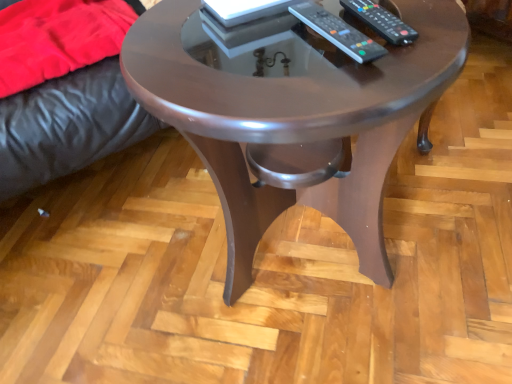
Question: Is shiny brown wood coffee table at center smaller than black plastic remote at center, the first remote in the left-to-right sequence?

Choices:
 (A) no
 (B) yes

Answer: (A)

Question: Is shiny brown wood coffee table at center oriented towards black plastic remote at center, the first remote in the left-to-right sequence?

Choices:
 (A) yes
 (B) no

Answer: (B)

Question: From the image's perspective, is shiny brown wood coffee table at center below black plastic remote at center, the first remote in the left-to-right sequence?

Choices:
 (A) yes
 (B) no

Answer: (A)

Question: Is shiny brown wood coffee table at center positioned with its back to black plastic remote at center, which is the 2th remote from right to left?

Choices:
 (A) yes
 (B) no

Answer: (B)

Question: From a real-world perspective, is shiny brown wood coffee table at center under black plastic remote at center, the first remote in the left-to-right sequence?

Choices:
 (A) yes
 (B) no

Answer: (A)

Question: From the image's perspective, is black plastic remote at center, the first remote in the left-to-right sequence, located above or below black plastic remote at upper right, marked as the 1th remote in a right-to-left arrangement?

Choices:
 (A) above
 (B) below

Answer: (B)

Question: Is black plastic remote at center, which is the 2th remote from right to left, to the left or to the right of black plastic remote at upper right, marked as the 1th remote in a right-to-left arrangement, in the image?

Choices:
 (A) left
 (B) right

Answer: (A)

Question: Considering their positions, is black plastic remote at center, which is the 2th remote from right to left, located in front of or behind black plastic remote at upper right, marked as the 1th remote in a right-to-left arrangement?

Choices:
 (A) behind
 (B) front

Answer: (B)

Question: Which is correct: black plastic remote at center, which is the 2th remote from right to left, is inside black plastic remote at upper right, positioned as the second remote in left-to-right order, or outside of it?

Choices:
 (A) outside
 (B) inside

Answer: (A)

Question: Looking at their shapes, would you say black plastic remote at center, the first remote in the left-to-right sequence, is wider or thinner than shiny brown wood coffee table at center?

Choices:
 (A) wide
 (B) thin

Answer: (B)

Question: From a real-world perspective, is black plastic remote at center, which is the 2th remote from right to left, physically located above or below shiny brown wood coffee table at center?

Choices:
 (A) above
 (B) below

Answer: (A)

Question: Is black plastic remote at center, which is the 2th remote from right to left, in front of or behind shiny brown wood coffee table at center in the image?

Choices:
 (A) front
 (B) behind

Answer: (B)

Question: Do you think black plastic remote at center, the first remote in the left-to-right sequence, is within shiny brown wood coffee table at center, or outside of it?

Choices:
 (A) outside
 (B) inside

Answer: (B)

Question: Considering their positions, is shiny brown wood coffee table at center located in front of or behind velvet red blanket at left?

Choices:
 (A) behind
 (B) front

Answer: (B)

Question: Considering the positions of shiny brown wood coffee table at center and velvet red blanket at left in the image, is shiny brown wood coffee table at center taller or shorter than velvet red blanket at left?

Choices:
 (A) short
 (B) tall

Answer: (B)